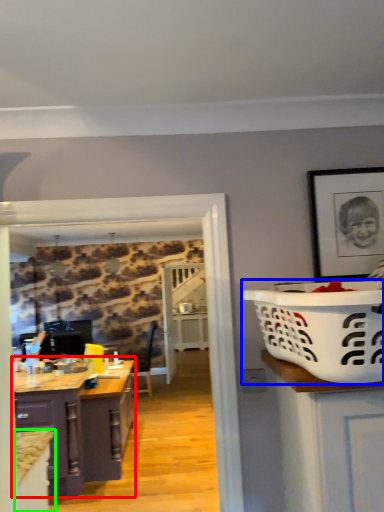
Question: Considering the real-world distances, which object is farthest from cabinetry (highlighted by a red box)? basket container (highlighted by a blue box) or cabinetry (highlighted by a green box)?

Choices:
 (A) basket container
 (B) cabinetry

Answer: (A)